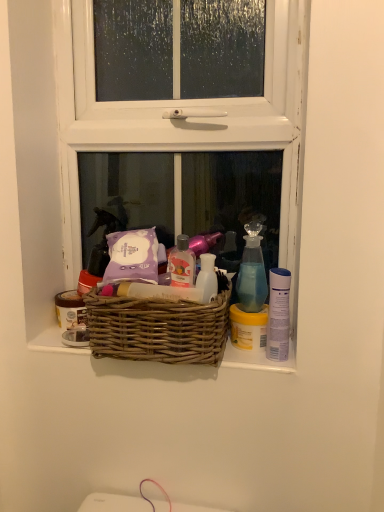
Question: Considering the positions of blue glass spray bottle at upper right and white wooden window at center in the image, is blue glass spray bottle at upper right wider or thinner than white wooden window at center?

Choices:
 (A) wide
 (B) thin

Answer: (B)

Question: In the image, is blue glass spray bottle at upper right on the left side or the right side of white wooden window at center?

Choices:
 (A) left
 (B) right

Answer: (B)

Question: Which of these objects is positioned farthest from the white wooden window at center?

Choices:
 (A) matte brown jar at left, the first toiletry when ordered from left to right
 (B) blue glass spray bottle at upper right
 (C) woven brown basket at center
 (D) yellow matte jar at right, the second toiletry viewed from the left

Answer: (A)

Question: Which of these objects is positioned farthest from the matte brown jar at left, the first toiletry when ordered from left to right?

Choices:
 (A) woven brown basket at center
 (B) blue glass spray bottle at upper right
 (C) yellow matte jar at right, arranged as the 2th toiletry when viewed from the back
 (D) white wooden window at center

Answer: (D)